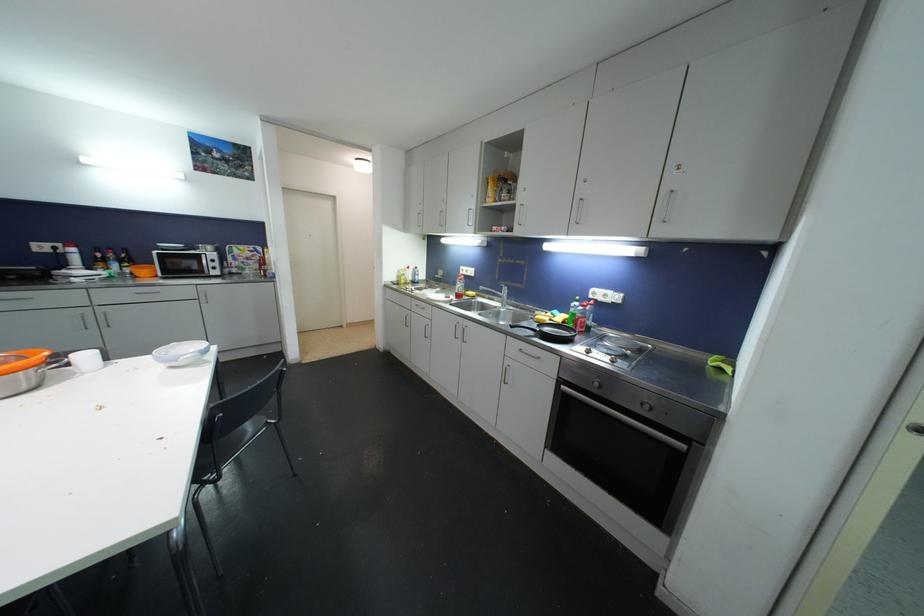
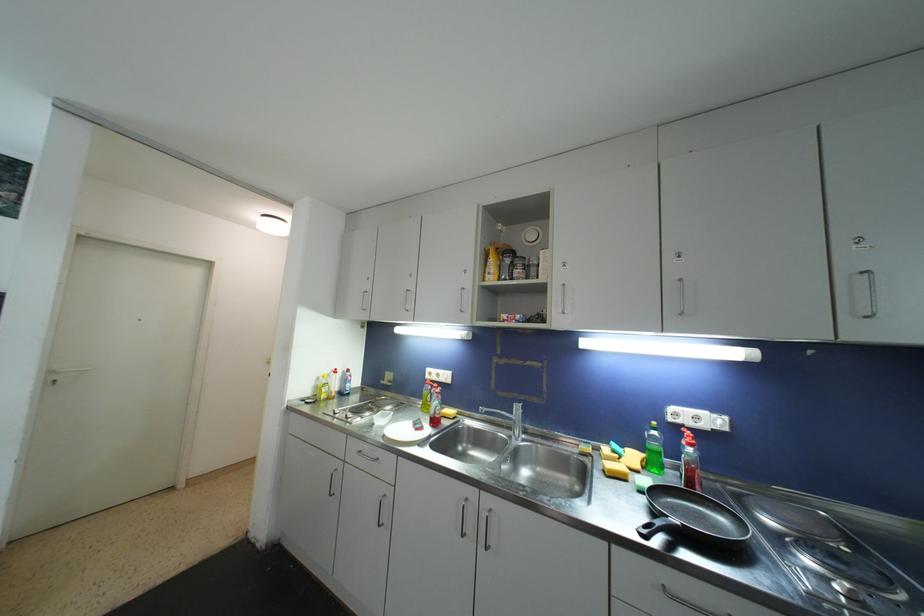
In a continuous first-person perspective shot, in which direction is the camera moving?

The cameraman walked toward left, forward.